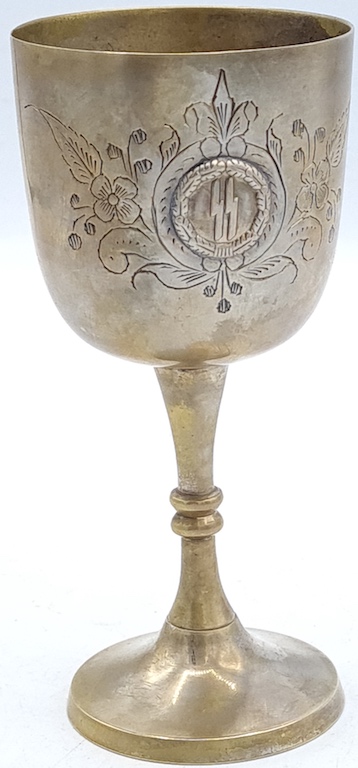
The height and width of the screenshot is (768, 358). I want to click on bowl of the goblet, so click(107, 288).